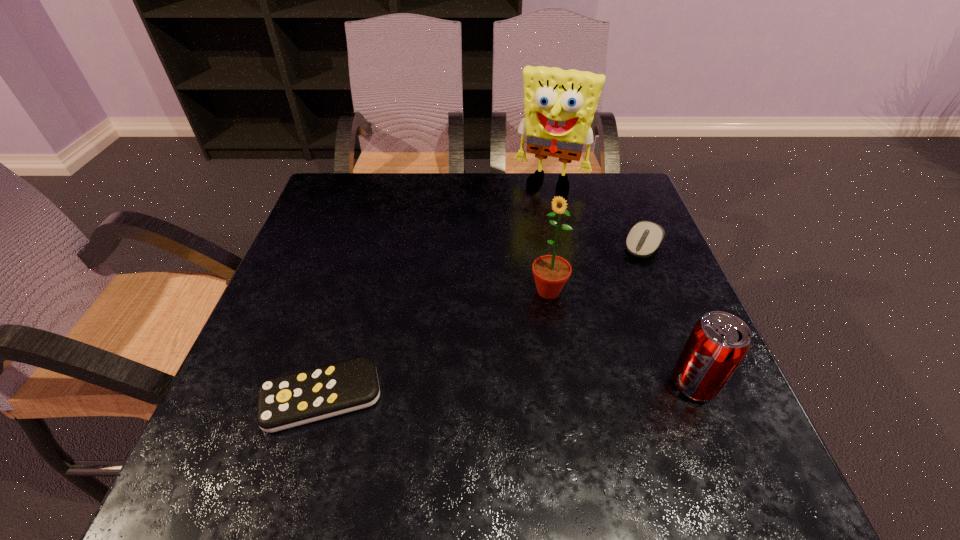
The image size is (960, 540). What are the coordinates of `vacant space located 0.240m on the left of the soda can` in the screenshot? It's located at (537, 384).

Locate an element on the screen. Image resolution: width=960 pixels, height=540 pixels. vacant position located on the face of the second tallest object is located at coordinates (501, 345).

This screenshot has height=540, width=960. Find the location of `vacant region located 0.280m on the face of the second tallest object`. vacant region located 0.280m on the face of the second tallest object is located at coordinates (456, 396).

Where is `vacant space located on the face of the second tallest object`? The width and height of the screenshot is (960, 540). vacant space located on the face of the second tallest object is located at coordinates pos(480,369).

Identify the location of vacant space located on the wheel side of the computer equipment. The image size is (960, 540). (586, 340).

Image resolution: width=960 pixels, height=540 pixels. Find the location of `free spot located on the wheel side of the computer equipment`. free spot located on the wheel side of the computer equipment is located at coordinates (586, 340).

The image size is (960, 540). What are the coordinates of `vacant space located on the wheel side of the computer equipment` in the screenshot? It's located at (572, 361).

Find the location of a particular element. The width and height of the screenshot is (960, 540). vacant area located on the face of the sponge is located at coordinates (509, 271).

Identify the location of vacant region located on the face of the sponge. Image resolution: width=960 pixels, height=540 pixels. (501, 288).

This screenshot has height=540, width=960. What are the coordinates of `blank space located 0.110m on the face of the sponge` in the screenshot? It's located at click(531, 219).